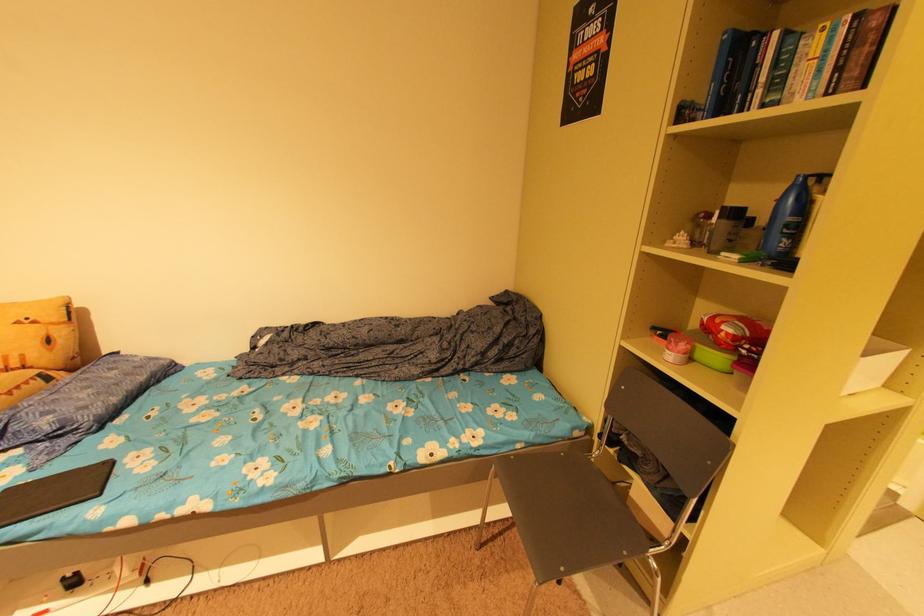
Describe the element at coordinates (865, 49) in the screenshot. I see `a red spine book` at that location.